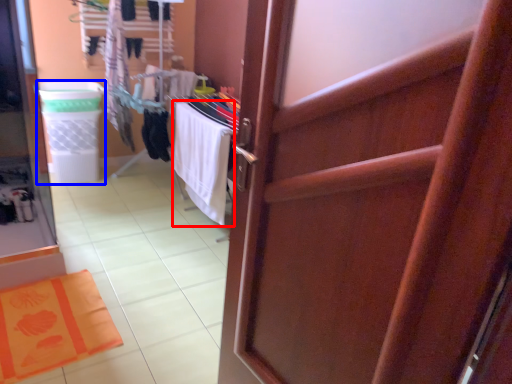
Question: Among these objects, which one is nearest to the camera, beach towel (highlighted by a red box) or laundry basket (highlighted by a blue box)?

Choices:
 (A) beach towel
 (B) laundry basket

Answer: (A)